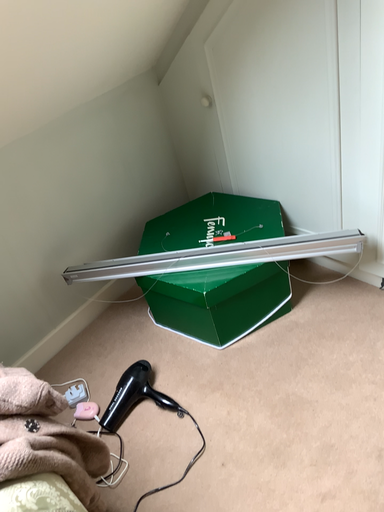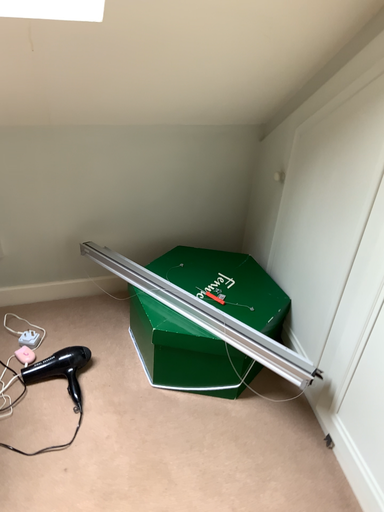
Question: How did the camera likely rotate when shooting the video?

Choices:
 (A) rotated left
 (B) rotated right

Answer: (A)